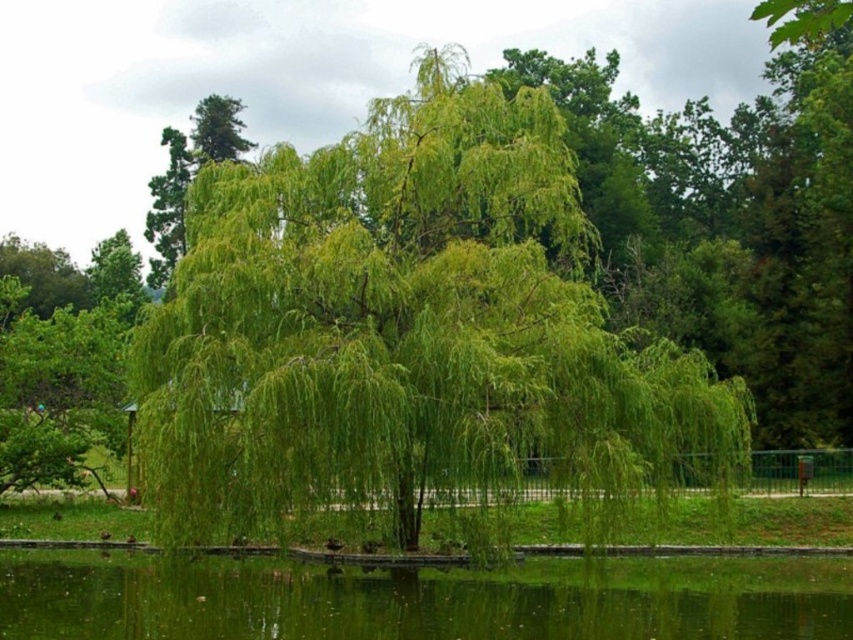
Question: From the image, what is the correct spatial relationship of green leafy willow at center in relation to green liquid water at lower center?

Choices:
 (A) left
 (B) right

Answer: (A)

Question: Which point is farther from the camera taking this photo?

Choices:
 (A) click(x=119, y=632)
 (B) click(x=276, y=177)

Answer: (B)

Question: Does green leafy willow at center have a larger size compared to green liquid water at lower center?

Choices:
 (A) yes
 (B) no

Answer: (A)

Question: Can you confirm if green leafy willow at center is positioned above green liquid water at lower center?

Choices:
 (A) yes
 (B) no

Answer: (A)